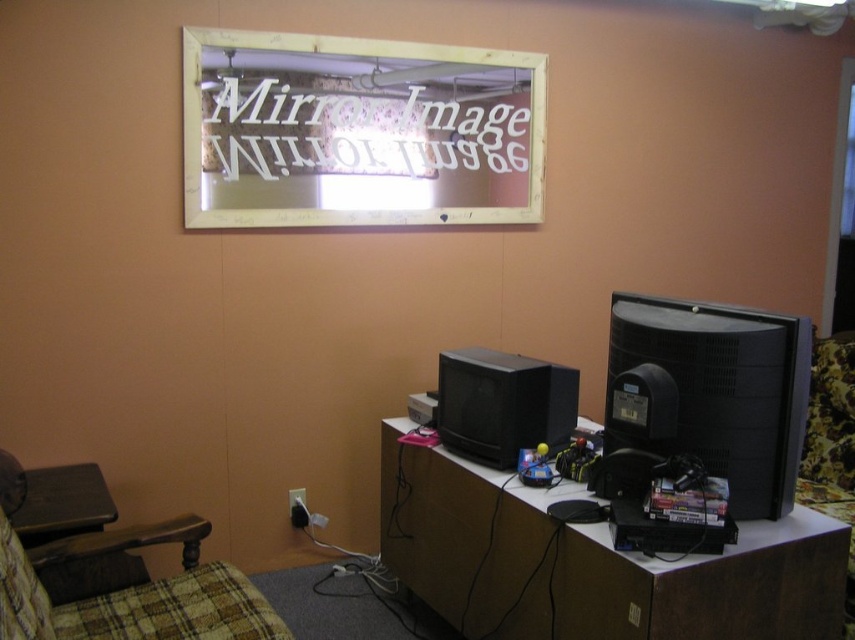
Question: Based on their relative distances, which object is farther from the brown wood table at lower left?

Choices:
 (A) plaid fabric swivel chair at lower left
 (B) gold-framed mirror at upper center
 (C) black matte computer monitor at right

Answer: (C)

Question: Is gold-framed mirror at upper center in front of black matte computer monitor at right?

Choices:
 (A) no
 (B) yes

Answer: (A)

Question: Does gold-framed mirror at upper center have a larger size compared to plaid fabric swivel chair at lower left?

Choices:
 (A) yes
 (B) no

Answer: (A)

Question: Estimate the real-world distances between objects in this image. Which object is farther from the black matte computer monitor at right?

Choices:
 (A) plaid fabric swivel chair at lower left
 (B) brown wood table at lower left
 (C) brown wood computer desk at center

Answer: (B)

Question: Which point is farther to the camera?

Choices:
 (A) black matte computer monitor at right
 (B) gold-framed mirror at upper center

Answer: (B)

Question: From the image, what is the correct spatial relationship of brown wood computer desk at center in relation to plaid fabric swivel chair at lower left?

Choices:
 (A) below
 (B) above

Answer: (B)